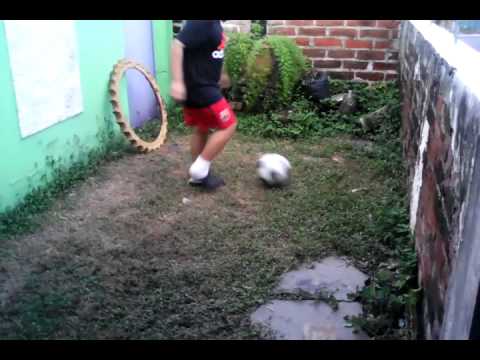
Identify the location of plant. This screenshot has height=360, width=480. (400, 244).